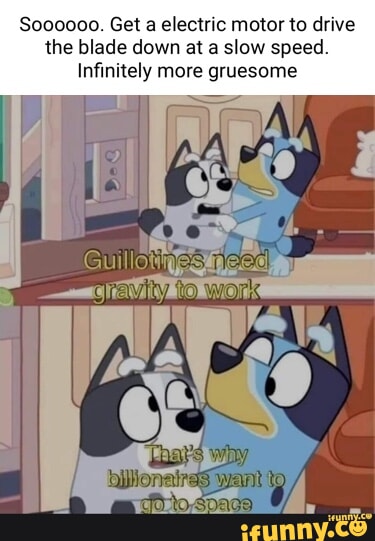
At what (x,y) coordinates should I click in order to perform the action: click on door. Please return your answer as a coordinate pair (x, y). Image resolution: width=375 pixels, height=541 pixels. Looking at the image, I should click on (206, 131), (125, 318).